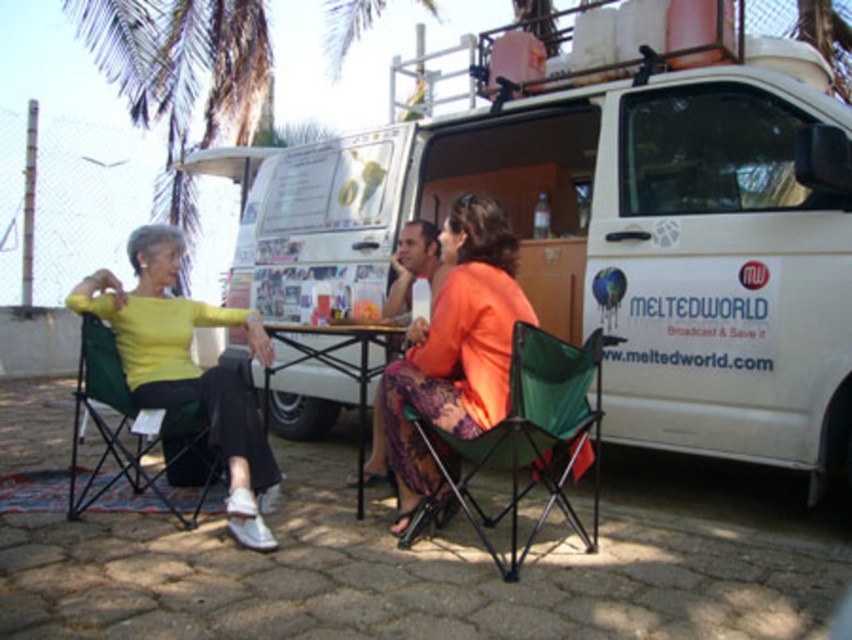
Where is `orange fabric dress at center`? This screenshot has height=640, width=852. orange fabric dress at center is located at coordinates (455, 348).

Is orange fabric dress at center closer to the viewer compared to matte plastic cup at center?

Yes, orange fabric dress at center is closer to the viewer.

The height and width of the screenshot is (640, 852). I want to click on orange fabric dress at center, so click(x=455, y=348).

You are a GUI agent. You are given a task and a screenshot of the screen. Output one action in this format:
    pyautogui.click(x=<x>, y=<y>)
    Task: Click on the white matte van at center
    This screenshot has width=852, height=640.
    Given the screenshot: What is the action you would take?
    pyautogui.click(x=611, y=237)

Which of these two, white matte van at center or matte plastic cup at center, stands taller?

With more height is white matte van at center.

Is point (235, 259) positioned behind point (392, 256)?

Yes.

Image resolution: width=852 pixels, height=640 pixels. I want to click on white matte van at center, so click(611, 237).

Is white matte van at center wider than orange fabric dress at center?

Correct, the width of white matte van at center exceeds that of orange fabric dress at center.

From the picture: Between white matte van at center and orange fabric dress at center, which one is positioned higher?

white matte van at center

Is point (343, 150) closer to viewer compared to point (436, 481)?

No, (343, 150) is behind (436, 481).

Where is `white matte van at center`? white matte van at center is located at coordinates (611, 237).